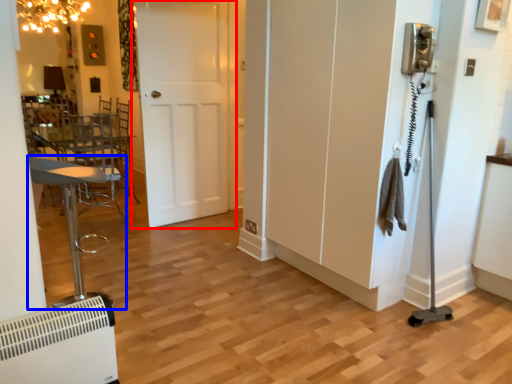
Question: Which point is closer to the camera, door (highlighted by a red box) or furniture (highlighted by a blue box)?

Choices:
 (A) door
 (B) furniture

Answer: (B)